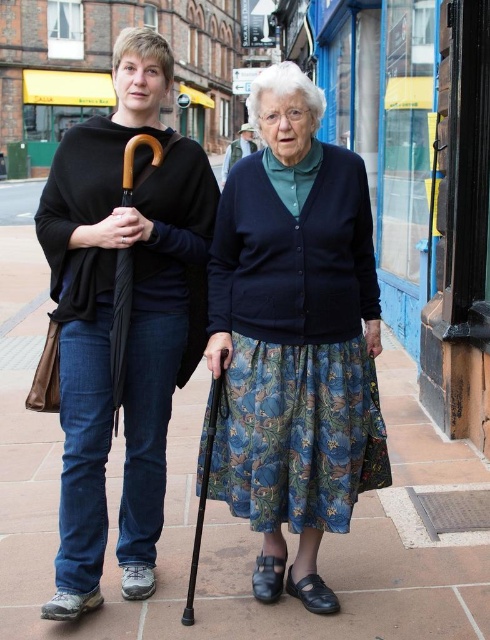
Does point (307, 609) come in front of point (198, 518)?

No, it is not.

Locate an element on the screen. This screenshot has width=490, height=640. matte black umbrella at left is located at coordinates (294, 337).

Find the location of a particular element. matte black umbrella at left is located at coordinates (294, 337).

How much distance is there between blue floral skirt at center and black matte umbrella at left?

blue floral skirt at center is 3.83 meters away from black matte umbrella at left.

Identify the location of blue floral skirt at center. (294, 337).

Find the location of `blue floral skirt at center`. blue floral skirt at center is located at coordinates (294, 337).

Who is more forward, (128,316) or (206,451)?

Point (206,451)

Can you confirm if black matte umbrella at left is smaller than wooden cane at lower center?

No, black matte umbrella at left is not smaller than wooden cane at lower center.

The width and height of the screenshot is (490, 640). What do you see at coordinates (121, 324) in the screenshot?
I see `black matte umbrella at left` at bounding box center [121, 324].

I want to click on black matte umbrella at left, so click(x=121, y=324).